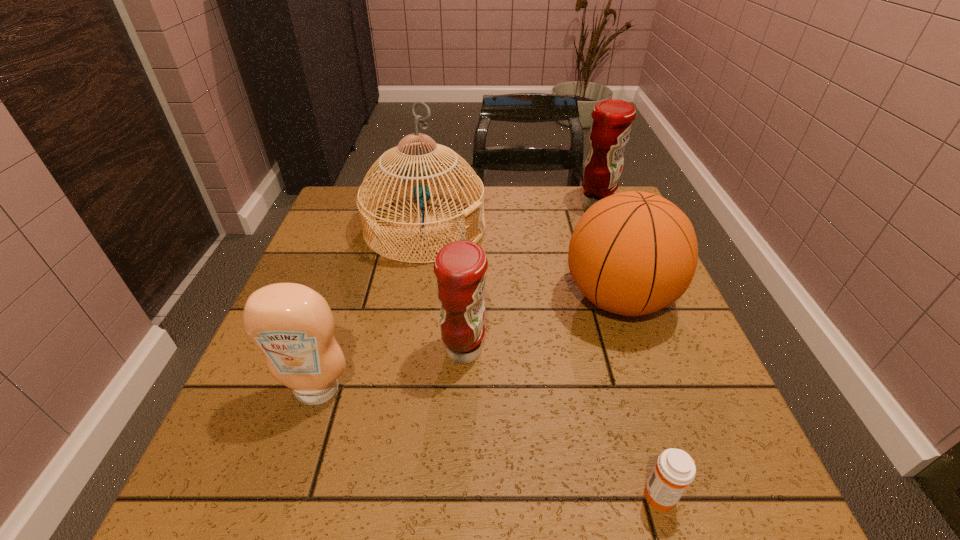
Image resolution: width=960 pixels, height=540 pixels. Find the location of `vacant space that satisfies the following two spatial constraints: 1. on the back side of the tallest condiment; 2. on the right side of the second condiment from left to right`. vacant space that satisfies the following two spatial constraints: 1. on the back side of the tallest condiment; 2. on the right side of the second condiment from left to right is located at coordinates pos(469,205).